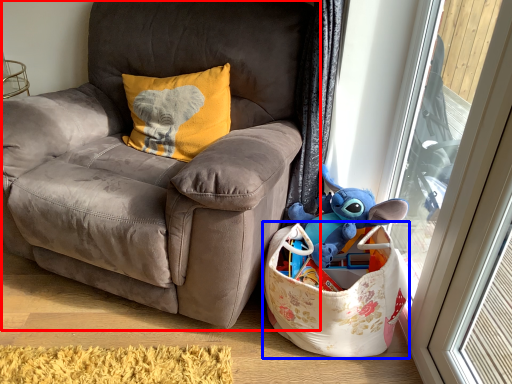
Question: Which object appears farthest to the camera in this image, chair (highlighted by a red box) or gift basket (highlighted by a blue box)?

Choices:
 (A) chair
 (B) gift basket

Answer: (B)